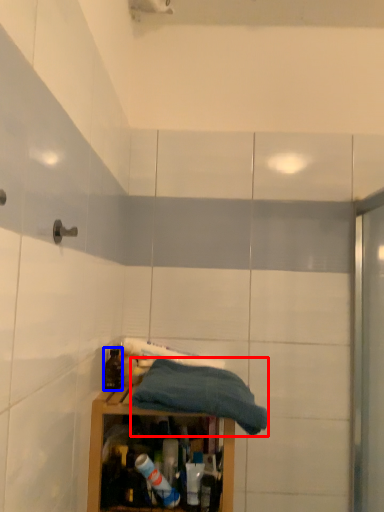
Question: Which point is closer to the camera, towel (highlighted by a red box) or bottle (highlighted by a blue box)?

Choices:
 (A) towel
 (B) bottle

Answer: (A)